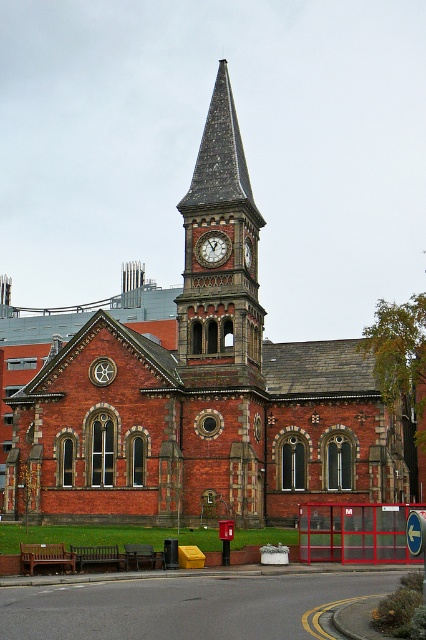
You are standing in front of the historic red brick building with a clock tower. You see two points marked on the ground in front of you. One is at point (206,237) and the other is at point (250,257). Which point is closer to you?

Point (206,237) is closer to the viewer than point (250,257).

You are a painter standing in front of the historic red brick building. You want to paint the dark brown stone clock tower at center and the matte brown clock at center. Which object should you focus on first if you want to paint the wider object first?

The dark brown stone clock tower at center is wider than the matte brown clock at center, so you should focus on painting the dark brown stone clock tower at center first.

In the scene shown: You are standing in front of the historic red brick building and want to take a photo that includes both the red brick church at center and the matte red clock at center. Which object should you focus on first to ensure both are in frame?

You should focus on the red brick church at center first because it is much taller than the matte red clock at center, so adjusting the camera angle to include its height will naturally include the smaller clock in the frame.